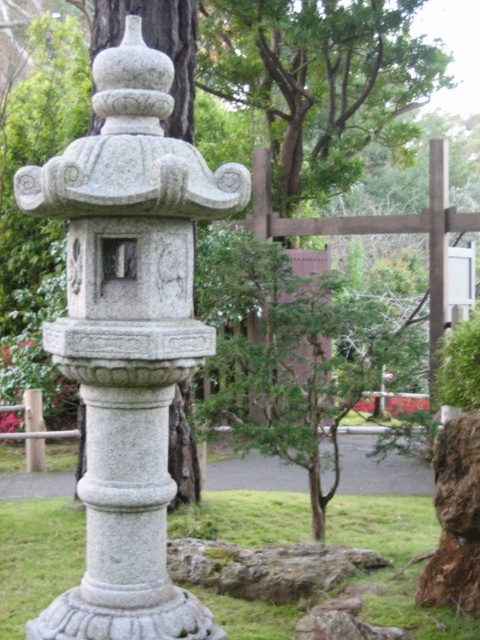
Which is below, gray stone lantern at center or gray stone pillar at center?

gray stone pillar at center is below.

Is gray stone lantern at center shorter than gray stone pillar at center?

Incorrect, gray stone lantern at center's height does not fall short of gray stone pillar at center's.

Who is more forward, (130, 209) or (464, 636)?

Point (130, 209) is more forward.

Image resolution: width=480 pixels, height=640 pixels. I want to click on gray stone lantern at center, so click(131, 193).